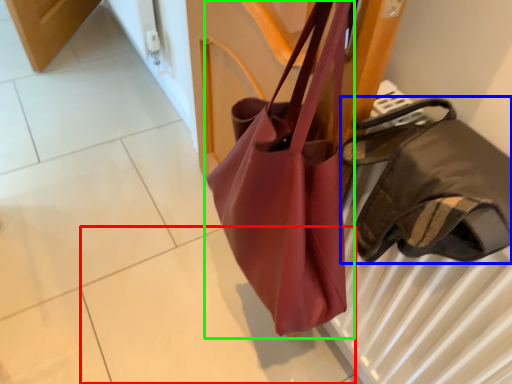
Question: Considering the real-world distances, which object is farthest from tile (highlighted by a red box)? handbag (highlighted by a blue box) or handbag (highlighted by a green box)?

Choices:
 (A) handbag
 (B) handbag

Answer: (A)